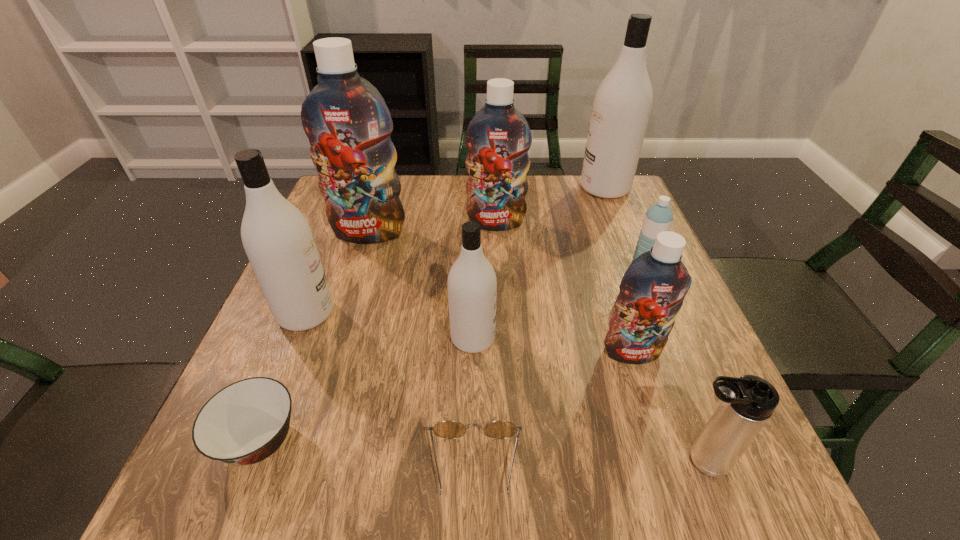
At what (x,y) coordinates should I click in order to perform the action: click on soup bowl that is at the left edge. Please return your answer as a coordinate pair (x, y). Looking at the image, I should click on (244, 423).

Where is `water bottle positioned at the right edge`? Image resolution: width=960 pixels, height=540 pixels. water bottle positioned at the right edge is located at coordinates (658, 218).

Find the location of `thermos bottle present at the right edge`. thermos bottle present at the right edge is located at coordinates (745, 405).

You are a GUI agent. You are given a task and a screenshot of the screen. Output one action in this format:
    pyautogui.click(x=<x>, y=<y>)
    Task: Click on the object that is at the far left corner
    The height and width of the screenshot is (540, 960).
    Given the screenshot: What is the action you would take?
    pyautogui.click(x=348, y=124)

In order to click on object that is at the near left corner in this screenshot , I will do `click(244, 423)`.

Where is `object that is at the far right corner`? The width and height of the screenshot is (960, 540). object that is at the far right corner is located at coordinates (622, 104).

I want to click on object that is positioned at the near right corner, so click(x=745, y=405).

Where is `free space at the far edge`? free space at the far edge is located at coordinates (467, 219).

Locate an element on the screen. The width and height of the screenshot is (960, 540). vacant space at the left edge of the desktop is located at coordinates (345, 264).

In the image, there is a desktop. Identify the location of vacant space at the right edge. This screenshot has width=960, height=540. (647, 387).